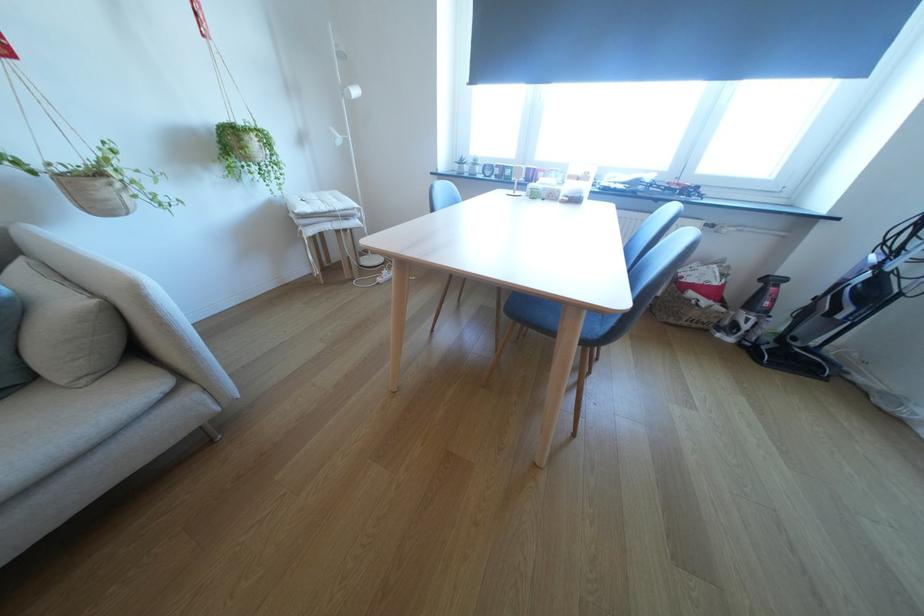
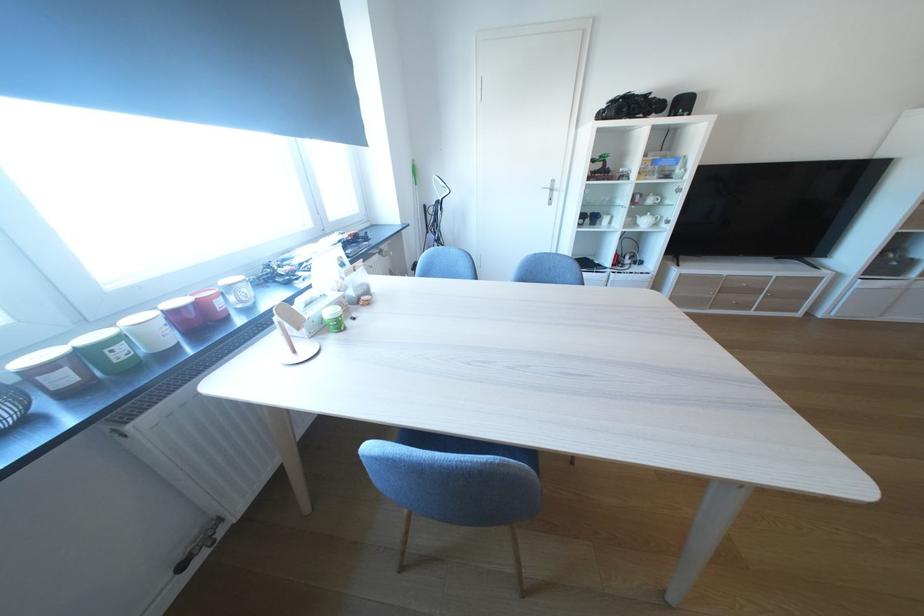
The point at [507,172] is marked in the first image. Where is the corresponding point in the second image?

(75, 379)